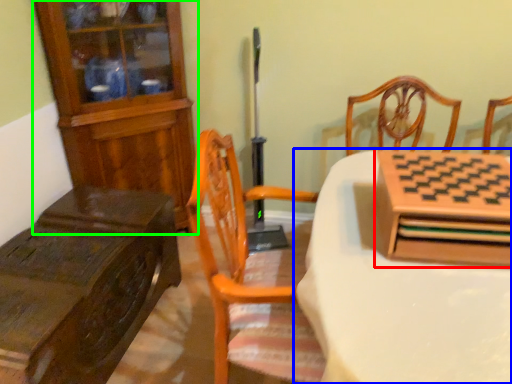
Question: Estimate the real-world distances between objects in this image. Which object is farther from cabinetry (highlighted by a red box), table (highlighted by a blue box) or cabinetry (highlighted by a green box)?

Choices:
 (A) table
 (B) cabinetry

Answer: (B)